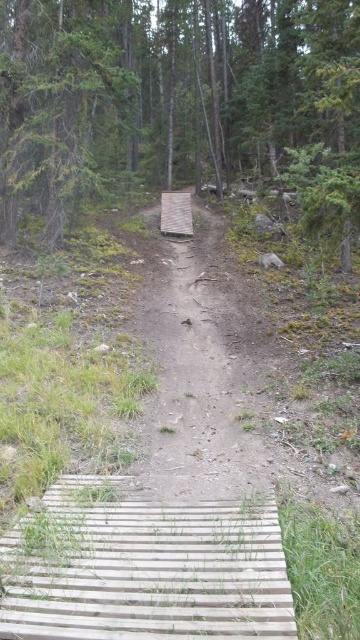
In the scene shown: Which is more to the right, green matte tree at upper left or wooden plank at center?

From the viewer's perspective, wooden plank at center appears more on the right side.

What do you see at coordinates (56, 106) in the screenshot?
I see `green matte tree at upper left` at bounding box center [56, 106].

Who is more forward, (111, 52) or (173, 202)?

Point (111, 52) is in front.

Locate an element on the screen. green matte tree at upper left is located at coordinates (56, 106).

Does point (16, 176) come farther from viewer compared to point (168, 209)?

No, (16, 176) is closer to viewer.

Is point (56, 65) positioned in front of point (189, 234)?

Yes, point (56, 65) is in front of point (189, 234).

The width and height of the screenshot is (360, 640). What are the coordinates of `green matte tree at upper center` in the screenshot? It's located at point(165,92).

Is green matte tree at upper center below green matte tree at upper left?

Actually, green matte tree at upper center is above green matte tree at upper left.

Does green matte tree at upper center appear on the right side of green matte tree at upper left?

Correct, you'll find green matte tree at upper center to the right of green matte tree at upper left.

Where is `green matte tree at upper center`? The height and width of the screenshot is (640, 360). green matte tree at upper center is located at coordinates (165, 92).